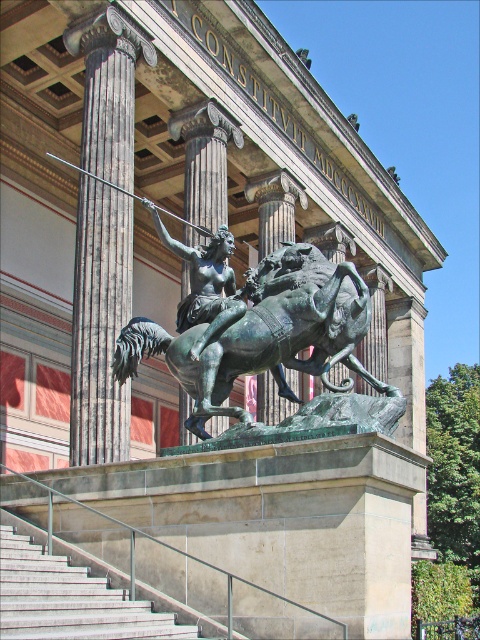
Is point (83, 600) more distant than point (232, 292)?

No, (83, 600) is closer to viewer.

Find the location of `gray concrete stairs at lower left`. gray concrete stairs at lower left is located at coordinates (70, 600).

You are a GUI agent. You are given a task and a screenshot of the screen. Output one action in this format:
    pyautogui.click(x=<x>, y=<y>)
    Task: Click on the gray concrete stairs at lower left
    This screenshot has width=480, height=640.
    Given the screenshot: What is the action you would take?
    pyautogui.click(x=70, y=600)

Does bronze/greenish patina horse at center appear on the left side of bronze statue at center?

No, bronze/greenish patina horse at center is not to the left of bronze statue at center.

Which is in front, point (305, 285) or point (214, 307)?

Positioned in front is point (305, 285).

At what (x,y) coordinates should I click in order to perform the action: click on bronze/greenish patina horse at center. Please return your answer as a coordinate pair (x, y). The height and width of the screenshot is (640, 480). Looking at the image, I should click on (264, 333).

Who is more forward, (337, 304) or (126, 620)?

Point (126, 620) is in front.

In the scene shown: Which is below, bronze/greenish patina horse at center or gray concrete stairs at lower left?

gray concrete stairs at lower left is below.

Is point (347, 314) more distant than point (11, 620)?

Yes, it is behind point (11, 620).

Where is `bronze/greenish patina horse at center`? bronze/greenish patina horse at center is located at coordinates (264, 333).